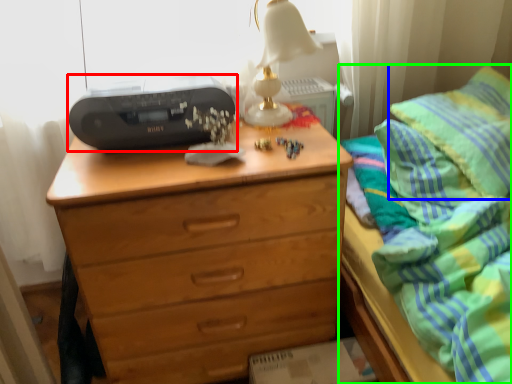
Question: Which is farther away from printer (highlighted by a red box)? pillow (highlighted by a blue box) or bed (highlighted by a green box)?

Choices:
 (A) pillow
 (B) bed

Answer: (A)